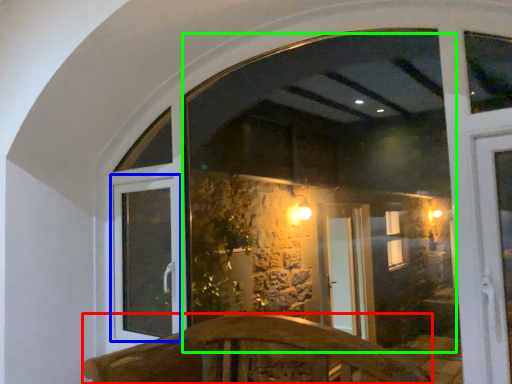
Question: Which is farther away from furniture (highlighted by a red box)? window frame (highlighted by a blue box) or window screen (highlighted by a green box)?

Choices:
 (A) window frame
 (B) window screen

Answer: (B)